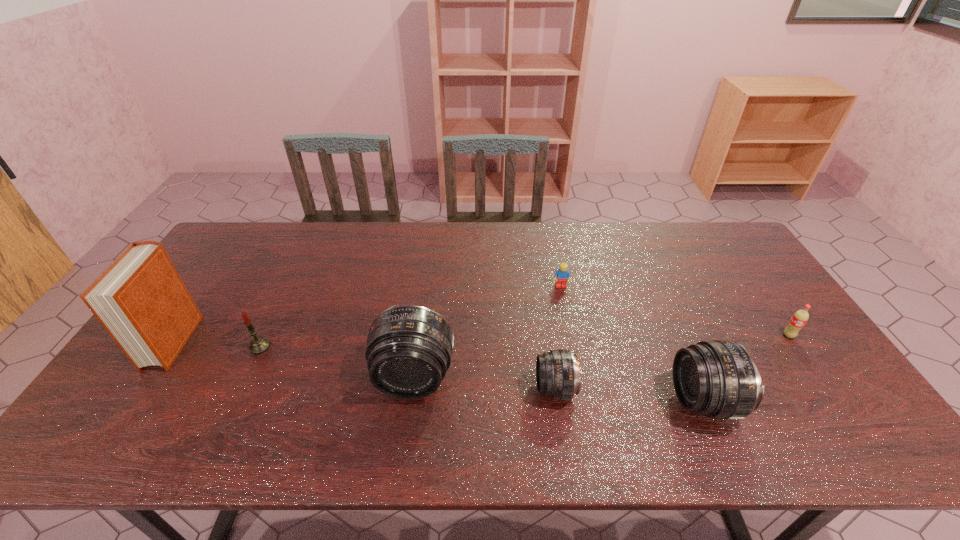
In order to click on vacant region between the third object from left to right and the second object from left to right in this screenshot , I will do `click(337, 362)`.

In order to click on free spot between the Lego and the rightmost object in this screenshot , I will do `click(675, 310)`.

Locate an element on the screen. This screenshot has width=960, height=540. unoccupied area between the rightmost object and the leftmost object is located at coordinates (481, 339).

Locate an element on the screen. The height and width of the screenshot is (540, 960). vacant area that lies between the candle and the third object from left to right is located at coordinates (337, 362).

Find the location of a particular element. The height and width of the screenshot is (540, 960). object that is the nearest to the soda is located at coordinates (718, 379).

Choose which object is the fifth nearest neighbor to the fifth object from right to left. Please provide its 2D coordinates. Your answer should be formatted as a tuple, i.e. [(x, y)], where the tuple contains the x and y coordinates of a point satisfying the conditions above.

[(718, 379)]

This screenshot has height=540, width=960. Identify the location of telephoto lens that is the second closest to the second object from left to right. (557, 371).

Point out which telephoto lens is positioned as the second nearest to the leftmost telephoto lens. Please provide its 2D coordinates. Your answer should be formatted as a tuple, i.e. [(x, y)], where the tuple contains the x and y coordinates of a point satisfying the conditions above.

[(718, 379)]

Where is `free space that satisfies the following two spatial constraints: 1. on the front side of the soda; 2. at the front element of the third tallest object`? free space that satisfies the following two spatial constraints: 1. on the front side of the soda; 2. at the front element of the third tallest object is located at coordinates (834, 401).

At what (x,y) coordinates should I click in order to perform the action: click on vacant space that satisfies the following two spatial constraints: 1. on the open cover of the second object from left to right; 2. on the left side of the hardback book. Please return your answer as a coordinate pair (x, y). This screenshot has height=540, width=960. Looking at the image, I should click on (170, 347).